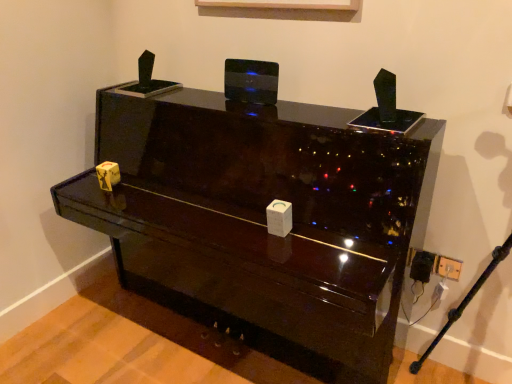
Identify the location of white plastic electric outlet at lower right. point(448,267).

Describe the element at coordinates (448, 267) in the screenshot. Image resolution: width=512 pixels, height=384 pixels. I see `white plastic electric outlet at lower right` at that location.

In order to face white plastic electric outlet at lower right, should I rotate leftwards or rightwards?

Rotate your view right by about 24.407°.

Describe the element at coordinates (263, 221) in the screenshot. I see `glossy black piano at center` at that location.

You are a GUI agent. You are given a task and a screenshot of the screen. Output one action in this format:
    pyautogui.click(x=<x>, y=<y>)
    Task: Click on the glossy black piano at center
    This screenshot has height=384, width=512.
    Given the screenshot: What is the action you would take?
    pyautogui.click(x=263, y=221)

I want to click on white plastic electric outlet at lower right, so click(x=448, y=267).

Considering the relative positions of white plastic electric outlet at lower right and glossy black piano at center in the image provided, is white plastic electric outlet at lower right to the left of glossy black piano at center from the viewer's perspective?

Incorrect, white plastic electric outlet at lower right is not on the left side of glossy black piano at center.

Which is behind, white plastic electric outlet at lower right or glossy black piano at center?

Positioned behind is white plastic electric outlet at lower right.

Considering the positions of point (445, 273) and point (262, 325), is point (445, 273) closer or farther from the camera than point (262, 325)?

Point (445, 273).

From the image's perspective, which object appears higher, white plastic electric outlet at lower right or glossy black piano at center?

glossy black piano at center appears higher in the image.

From a real-world perspective, which is physically below, white plastic electric outlet at lower right or glossy black piano at center?

white plastic electric outlet at lower right, from a real-world perspective.

Which of these two, white plastic electric outlet at lower right or glossy black piano at center, is thinner?

white plastic electric outlet at lower right is thinner.

From their relative heights in the image, would you say white plastic electric outlet at lower right is taller or shorter than glossy black piano at center?

white plastic electric outlet at lower right is shorter than glossy black piano at center.

Considering the sizes of objects white plastic electric outlet at lower right and glossy black piano at center in the image provided, who is bigger, white plastic electric outlet at lower right or glossy black piano at center?

glossy black piano at center.

Would you say white plastic electric outlet at lower right is outside glossy black piano at center?

That's correct, white plastic electric outlet at lower right is outside of glossy black piano at center.

Is white plastic electric outlet at lower right positioned far away from glossy black piano at center?

That's not correct — white plastic electric outlet at lower right is a little close to glossy black piano at center.

Is white plastic electric outlet at lower right oriented towards glossy black piano at center?

No, white plastic electric outlet at lower right is not turned towards glossy black piano at center.

How many degrees apart are the facing directions of white plastic electric outlet at lower right and glossy black piano at center?

0.641 degrees separate the facing orientations of white plastic electric outlet at lower right and glossy black piano at center.

You are a GUI agent. You are given a task and a screenshot of the screen. Output one action in this format:
    pyautogui.click(x=<x>, y=<y>)
    Task: Click on the furniture to the left of white plastic electric outlet at lower right
    
    Given the screenshot: What is the action you would take?
    pyautogui.click(x=263, y=221)

Which is more to the left, glossy black piano at center or white plastic electric outlet at lower right?

Positioned to the left is glossy black piano at center.

Does glossy black piano at center lie behind white plastic electric outlet at lower right?

No, it is not.

Is point (360, 166) farther from viewer compared to point (457, 263)?

No, (360, 166) is closer to viewer.

From the image's perspective, which object appears higher, glossy black piano at center or white plastic electric outlet at lower right?

glossy black piano at center.

From a real-world perspective, which object stands above the other?

glossy black piano at center is physically above.

Considering the sizes of glossy black piano at center and white plastic electric outlet at lower right in the image, is glossy black piano at center wider or thinner than white plastic electric outlet at lower right?

Clearly, glossy black piano at center has more width compared to white plastic electric outlet at lower right.

Between glossy black piano at center and white plastic electric outlet at lower right, which one has less height?

Standing shorter between the two is white plastic electric outlet at lower right.

Considering the sizes of glossy black piano at center and white plastic electric outlet at lower right in the image, is glossy black piano at center bigger or smaller than white plastic electric outlet at lower right?

In the image, glossy black piano at center appears to be larger than white plastic electric outlet at lower right.

Can we say glossy black piano at center lies outside white plastic electric outlet at lower right?

Yes, glossy black piano at center is not within white plastic electric outlet at lower right.

Is glossy black piano at center far from white plastic electric outlet at lower right?

They are positioned close to each other.

Is glossy black piano at center oriented towards white plastic electric outlet at lower right?

No, glossy black piano at center does not turn towards white plastic electric outlet at lower right.

How many degrees apart are the facing directions of glossy black piano at center and white plastic electric outlet at lower right?

The facing directions of glossy black piano at center and white plastic electric outlet at lower right are 0.641 degrees apart.

Measure the distance between glossy black piano at center and white plastic electric outlet at lower right.

glossy black piano at center is 33.45 inches from white plastic electric outlet at lower right.

In order to click on electric outlet below the glossy black piano at center (from a real-world perspective) in this screenshot , I will do `click(448, 267)`.

Image resolution: width=512 pixels, height=384 pixels. What are the coordinates of `furniture in front of the white plastic electric outlet at lower right` in the screenshot? It's located at (263, 221).

The width and height of the screenshot is (512, 384). What are the coordinates of `electric outlet below the glossy black piano at center (from the image's perspective)` in the screenshot? It's located at click(x=448, y=267).